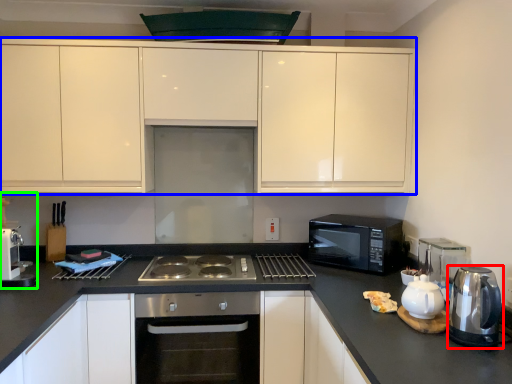
Question: Estimate the real-world distances between objects in this image. Which object is closer to kitchen appliance (highlighted by a red box), cabinetry (highlighted by a blue box) or coffee machine (highlighted by a green box)?

Choices:
 (A) cabinetry
 (B) coffee machine

Answer: (A)